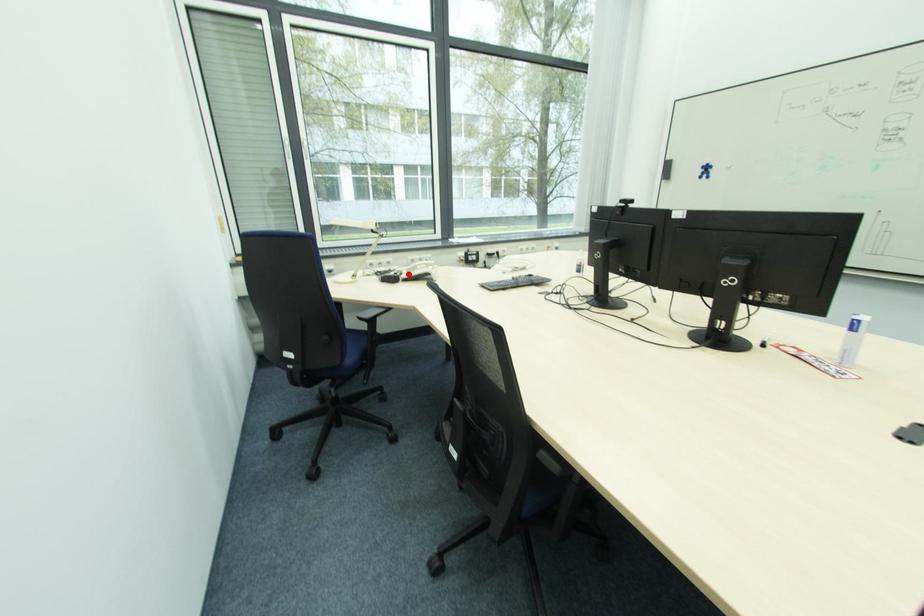
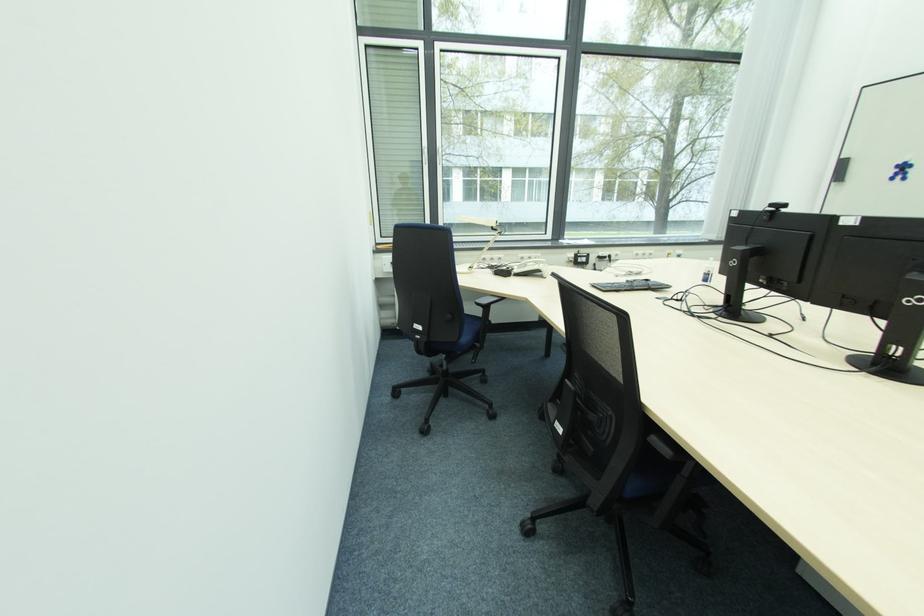
In the second image, find the point that corresponds to the highlighted location in the first image.

(519, 270)